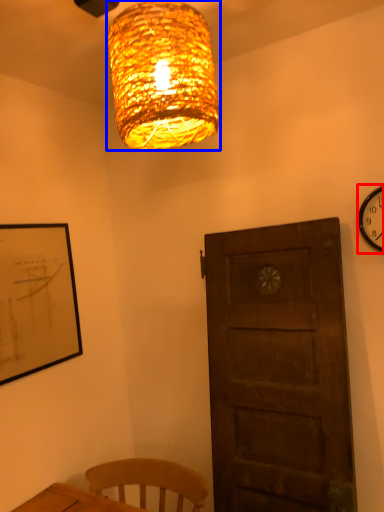
Question: Which object is closer to the camera taking this photo, wall clock (highlighted by a red box) or lamp (highlighted by a blue box)?

Choices:
 (A) wall clock
 (B) lamp

Answer: (B)